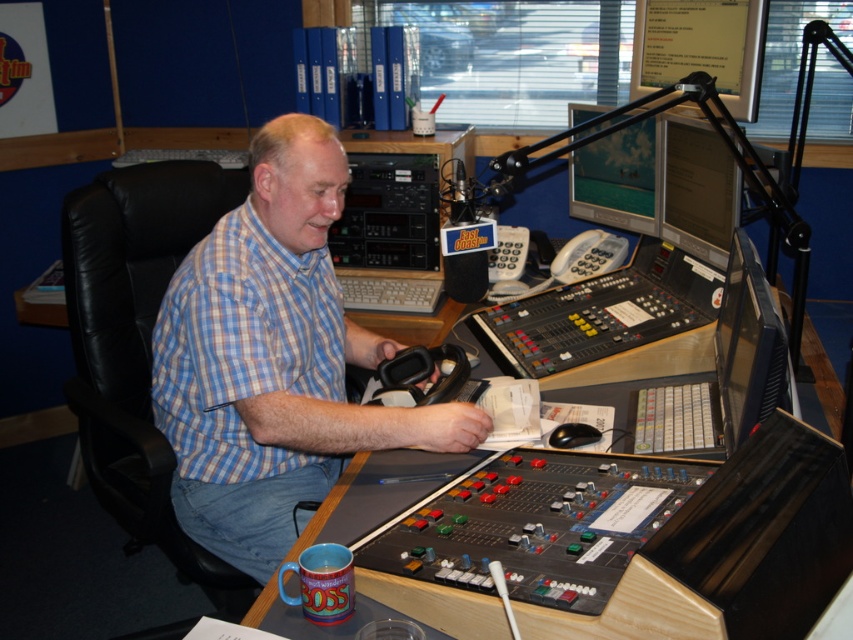
Consider the image. You are a technician entering the radio station control room and need to access the matte black monitor at upper right. However, there is a wooden desk at center blocking your path. Can you walk around the desk to reach the monitor?

The wooden desk at center is in front of matte black monitor at upper right, so you can walk around the desk to access the matte black monitor at upper right.

You are an intern at the radio station and need to place a large equipment box on the wooden desk at center or the matte black monitor at upper right. Based on their sizes, which surface can accommodate the box without it falling off?

The wooden desk at center is larger in size than the matte black monitor at upper right, so the box should be placed on the wooden desk at center to ensure stability and prevent it from falling off.

You are a technician in the radio station control room. You need to locate the blue checkered shirt at center. Where exactly is it positioned in the image?

The blue checkered shirt at center is positioned at point 0.562 on the x axis and 0.321 on the y axis.